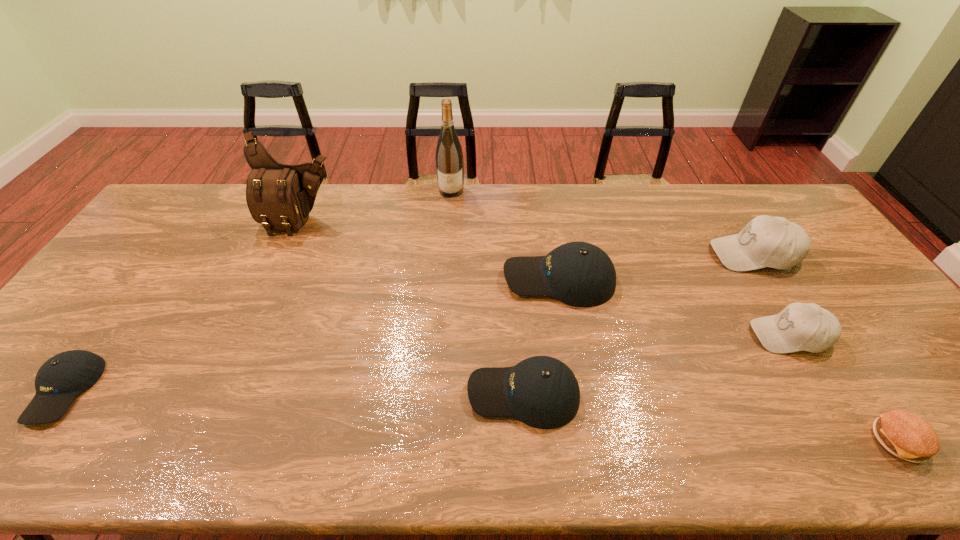
The width and height of the screenshot is (960, 540). I want to click on free spot between the leftmost baseball cap and the second biggest blue baseball cap, so click(294, 392).

Find the location of `vacant region between the hamburger and the farthest blue baseball cap`. vacant region between the hamburger and the farthest blue baseball cap is located at coordinates (729, 360).

This screenshot has width=960, height=540. Identify the location of vacant space that's between the second smallest blue baseball cap and the hamburger. (711, 417).

This screenshot has width=960, height=540. In order to click on vacant space in between the wine bottle and the bigger gray baseball cap in this screenshot , I will do `click(602, 222)`.

Where is `unoccupied area between the smallest blue baseball cap and the wine bottle`? This screenshot has height=540, width=960. unoccupied area between the smallest blue baseball cap and the wine bottle is located at coordinates (258, 290).

You are a GUI agent. You are given a task and a screenshot of the screen. Output one action in this format:
    pyautogui.click(x=<x>, y=<y>)
    Task: Click on the vacant space that's between the biggest blue baseball cap and the second smallest blue baseball cap
    
    Given the screenshot: What is the action you would take?
    pyautogui.click(x=541, y=336)

Image resolution: width=960 pixels, height=540 pixels. Identify the location of object that is the closest one to the brown wine bottle. (580, 274).

Locate which object is the second closest to the leftmost baseball cap. Please provide its 2D coordinates. Your answer should be formatted as a tuple, i.e. [(x, y)], where the tuple contains the x and y coordinates of a point satisfying the conditions above.

[(542, 392)]

Point out which baseball cap is positioned as the fifth nearest to the seventh object from right to left. Please provide its 2D coordinates. Your answer should be formatted as a tuple, i.e. [(x, y)], where the tuple contains the x and y coordinates of a point satisfying the conditions above.

[(799, 326)]

In order to click on the fourth closest baseball cap to the shoulder bag in this screenshot , I will do `click(766, 241)`.